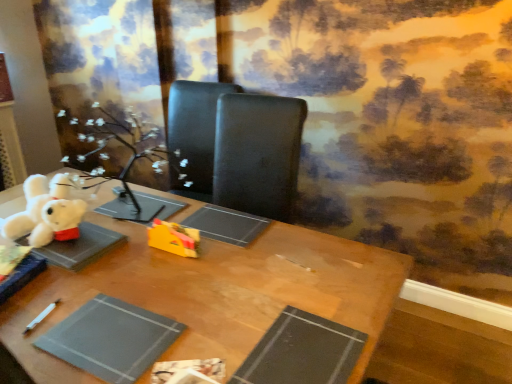
This screenshot has width=512, height=384. What are the coordinates of `unoccupied area in front of white plush bear at upper left, which appears as the 2th toy when viewed from the right` in the screenshot? It's located at (54, 269).